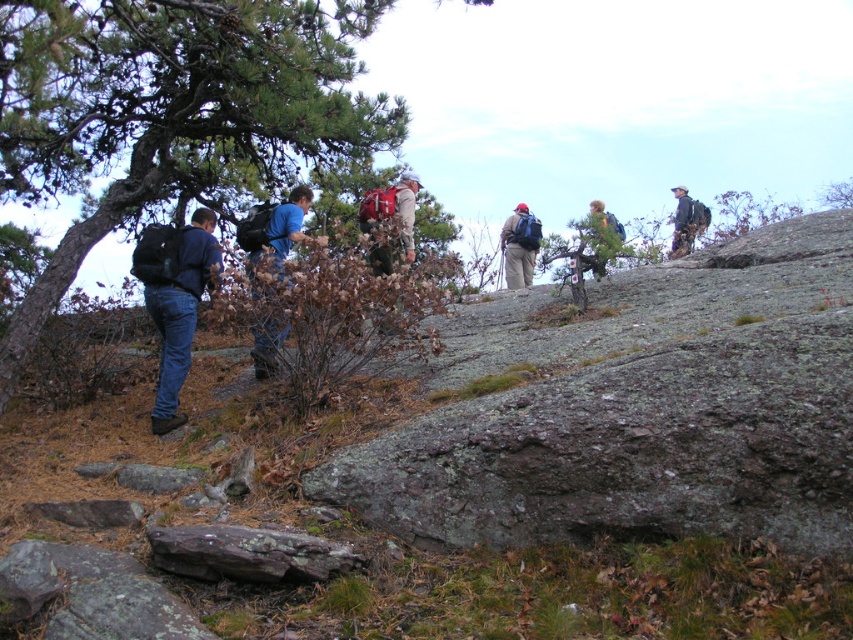
Question: Which point is closer to the camera?

Choices:
 (A) dark blue jeans at left
 (B) matte red backpack at center
 (C) camouflage jacket at upper right

Answer: (A)

Question: Is brown rough rock at center further to camera compared to dark blue jeans at left?

Choices:
 (A) no
 (B) yes

Answer: (A)

Question: Can you confirm if green leafy tree at upper left is positioned above camouflage jacket at upper right?

Choices:
 (A) yes
 (B) no

Answer: (A)

Question: Can you confirm if brown mossy rock at center is thinner than matte red backpack at center?

Choices:
 (A) no
 (B) yes

Answer: (A)

Question: Which is farther from the camouflage jacket at upper right?

Choices:
 (A) brown mossy rock at center
 (B) matte red backpack at center
 (C) matte blue backpack at center

Answer: (A)

Question: Which point is closer to the camera taking this photo?

Choices:
 (A) (532, 256)
 (B) (387, 266)
 (C) (270, 218)

Answer: (C)